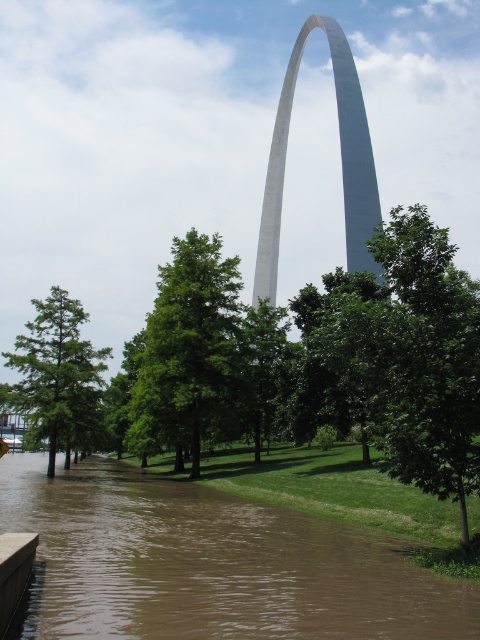
Does brown muddy water at lower left have a greater height compared to white polished stone arch at center?

Incorrect, brown muddy water at lower left's height is not larger of white polished stone arch at center's.

Who is more forward, (48, 612) or (345, 120)?

Positioned in front is point (48, 612).

Identify the location of brown muddy water at lower left. (210, 563).